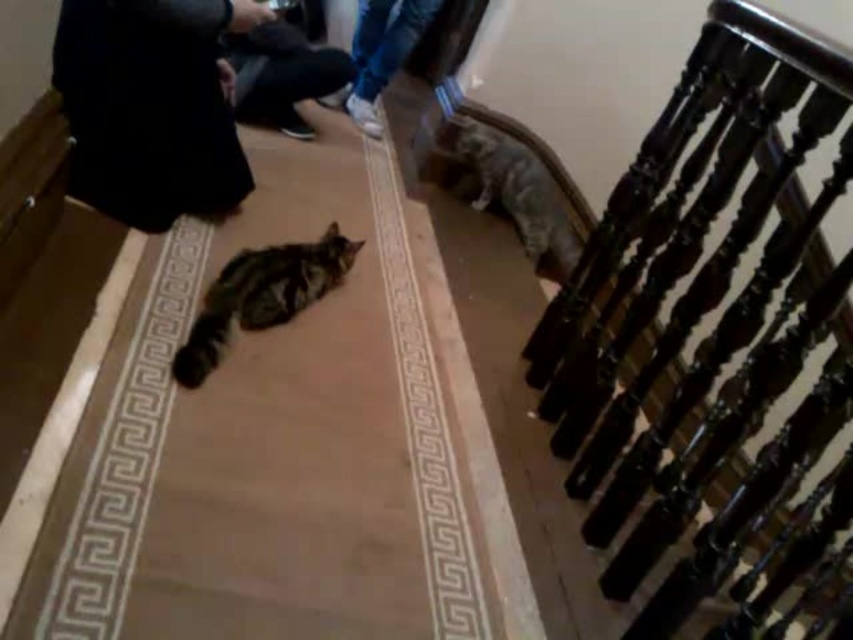
Between tabby fur cat at center and black fabric pants at upper left, which one appears on the right side from the viewer's perspective?

Positioned to the right is tabby fur cat at center.

Can you confirm if tabby fur cat at center is positioned to the right of black fabric pants at upper left?

Correct, you'll find tabby fur cat at center to the right of black fabric pants at upper left.

Where is `tabby fur cat at center`? This screenshot has width=853, height=640. tabby fur cat at center is located at coordinates (260, 296).

You are a GUI agent. You are given a task and a screenshot of the screen. Output one action in this format:
    pyautogui.click(x=<x>, y=<y>)
    Task: Click on the tabby fur cat at center
    
    Given the screenshot: What is the action you would take?
    pyautogui.click(x=260, y=296)

Does tabby fur cat at upper right have a smaller size compared to denim pants at upper center?

Correct, tabby fur cat at upper right occupies less space than denim pants at upper center.

Who is shorter, tabby fur cat at upper right or denim pants at upper center?

Standing shorter between the two is denim pants at upper center.

At what (x,y) coordinates should I click in order to perform the action: click on tabby fur cat at upper right. Please return your answer as a coordinate pair (x, y). This screenshot has width=853, height=640. Looking at the image, I should click on (518, 195).

Who is positioned more to the right, black fabric pants at upper left or denim pants at upper center?

Positioned to the right is denim pants at upper center.

Which of these two, black fabric pants at upper left or denim pants at upper center, stands taller?

denim pants at upper center is taller.

Image resolution: width=853 pixels, height=640 pixels. In order to click on black fabric pants at upper left in this screenshot , I will do `click(281, 74)`.